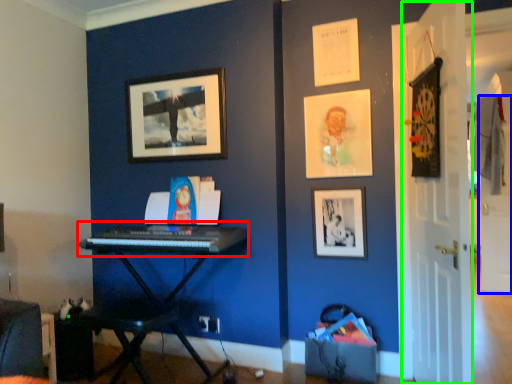
Question: Estimate the real-world distances between objects in this image. Which object is farther from musical keyboard (highlighted by a red box), door (highlighted by a blue box) or door (highlighted by a green box)?

Choices:
 (A) door
 (B) door

Answer: (A)